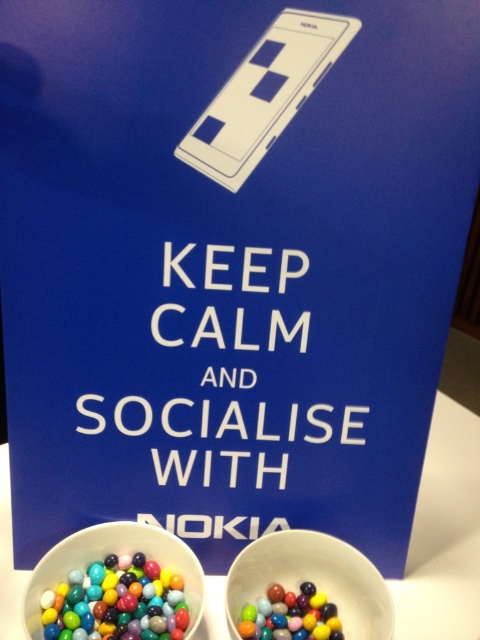
Is point (340, 580) more distant than point (340, 625)?

Yes, it is.

Measure the distance between matte ceramic bowl at lower center and glossy plastic candy at lower center.

The distance of matte ceramic bowl at lower center from glossy plastic candy at lower center is 3.44 centimeters.

You are a GUI agent. You are given a task and a screenshot of the screen. Output one action in this format:
    pyautogui.click(x=<x>, y=<y>)
    Task: Click on the matte ceramic bowl at lower center
    This screenshot has width=480, height=640.
    Given the screenshot: What is the action you would take?
    pyautogui.click(x=312, y=579)

Who is more distant from viewer, [472,611] or [290,598]?

Point [472,611]

Where is `white glossy bowls at lower center`? The image size is (480, 640). white glossy bowls at lower center is located at coordinates (444, 534).

Between point (2, 628) and point (289, 611), which one is positioned in front?

Point (2, 628)

Locate an element on the screen. The height and width of the screenshot is (640, 480). white glossy bowls at lower center is located at coordinates (444, 534).

This screenshot has width=480, height=640. What do you see at coordinates (444, 534) in the screenshot?
I see `white glossy bowls at lower center` at bounding box center [444, 534].

Is point (462, 486) less distant than point (93, 630)?

No.

Is point (444, 602) behind point (121, 628)?

That is True.

The image size is (480, 640). I want to click on white glossy bowls at lower center, so click(x=444, y=534).